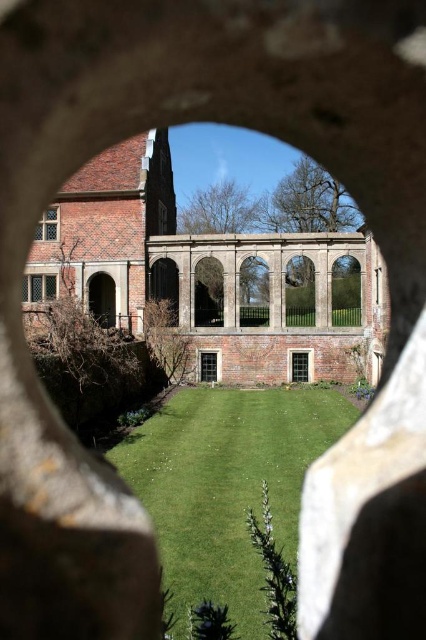
You are an architect examining the courtyard through the circular stone opening. You notice two windows in the courtyard building. The first is a matte glass window at lower left, and the second is a green glass window at center. Which of these two windows has a greater width?

The matte glass window at lower left has a greater width than the green glass window at center.

You are standing in the courtyard looking through the circular stone opening. There are two points marked in the scene. The first point is at coordinates point (164, 220) and the second is at point (236, 518). Which point is closer to you?

Point (164, 220) is further to the camera than point (236, 518). Therefore, the second point at (236, 518) is closer to you.

You are standing in front of the circular stone opening and looking at the courtyard through it. There are two points marked in the scene, point [34,296] and point [308,378]. Which point is closer to you?

Point [34,296] is closer to you because it is further to the viewer than point [308,378].